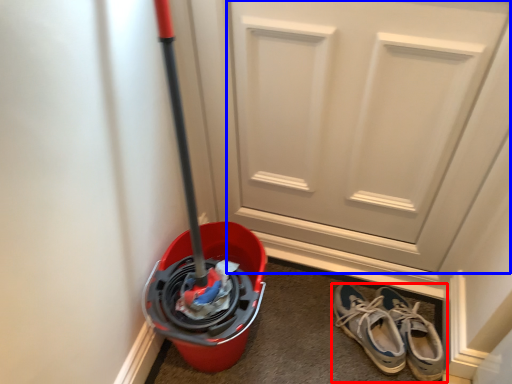
Question: Which object is closer to the camera taking this photo, footwear (highlighted by a red box) or door (highlighted by a blue box)?

Choices:
 (A) footwear
 (B) door

Answer: (B)